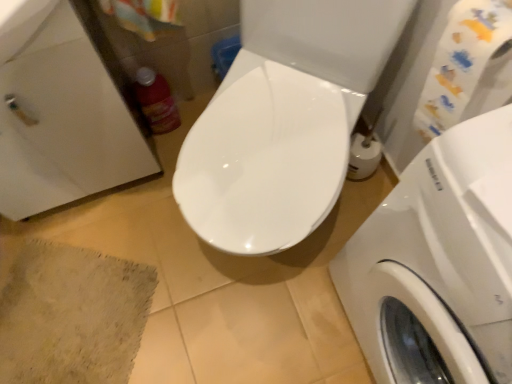
Question: Can you confirm if matte plastic bottle at left is positioned to the left of beige textured bath mat at lower left?

Choices:
 (A) yes
 (B) no

Answer: (B)

Question: Can you confirm if matte plastic bottle at left is wider than beige textured bath mat at lower left?

Choices:
 (A) no
 (B) yes

Answer: (A)

Question: From the image's perspective, is matte plastic bottle at left below beige textured bath mat at lower left?

Choices:
 (A) no
 (B) yes

Answer: (A)

Question: Are matte plastic bottle at left and beige textured bath mat at lower left far apart?

Choices:
 (A) yes
 (B) no

Answer: (B)

Question: Is matte plastic bottle at left taller than beige textured bath mat at lower left?

Choices:
 (A) yes
 (B) no

Answer: (A)

Question: From a real-world perspective, is matte plastic bottle at left above or below white glossy washing machine at right?

Choices:
 (A) above
 (B) below

Answer: (B)

Question: Is matte plastic bottle at left situated inside white glossy washing machine at right or outside?

Choices:
 (A) outside
 (B) inside

Answer: (A)

Question: From the image's perspective, is matte plastic bottle at left above or below white glossy washing machine at right?

Choices:
 (A) above
 (B) below

Answer: (A)

Question: In terms of height, does matte plastic bottle at left look taller or shorter compared to white glossy washing machine at right?

Choices:
 (A) tall
 (B) short

Answer: (B)

Question: In terms of height, does matte plastic bottle at left look taller or shorter compared to beige textured bath mat at lower left?

Choices:
 (A) tall
 (B) short

Answer: (A)

Question: Do you think matte plastic bottle at left is within beige textured bath mat at lower left, or outside of it?

Choices:
 (A) inside
 (B) outside

Answer: (B)

Question: Considering their positions, is matte plastic bottle at left located in front of or behind beige textured bath mat at lower left?

Choices:
 (A) behind
 (B) front

Answer: (A)

Question: From a real-world perspective, relative to beige textured bath mat at lower left, is matte plastic bottle at left vertically above or below?

Choices:
 (A) above
 (B) below

Answer: (A)

Question: From the image's perspective, relative to matte plastic bottle at left, is white glossy washing machine at right above or below?

Choices:
 (A) above
 (B) below

Answer: (B)

Question: Is white glossy washing machine at right taller or shorter than matte plastic bottle at left?

Choices:
 (A) tall
 (B) short

Answer: (A)